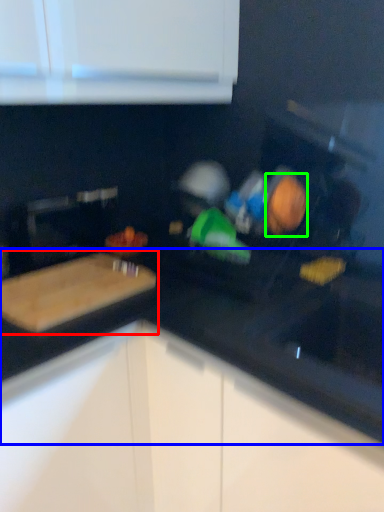
Question: Considering the real-world distances, which object is closest to cutting board (highlighted by a red box)? countertop (highlighted by a blue box) or food (highlighted by a green box).

Choices:
 (A) countertop
 (B) food

Answer: (A)